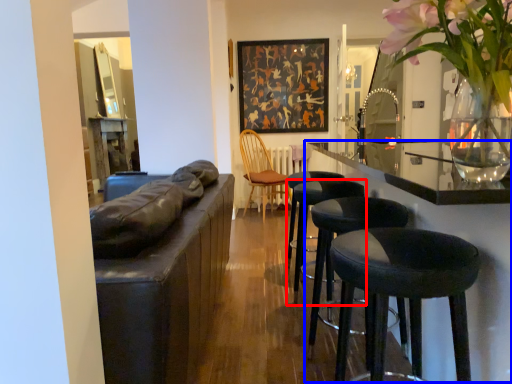
Question: Which object is further to the camera taking this photo, stool (highlighted by a red box) or counter top (highlighted by a blue box)?

Choices:
 (A) stool
 (B) counter top

Answer: (A)